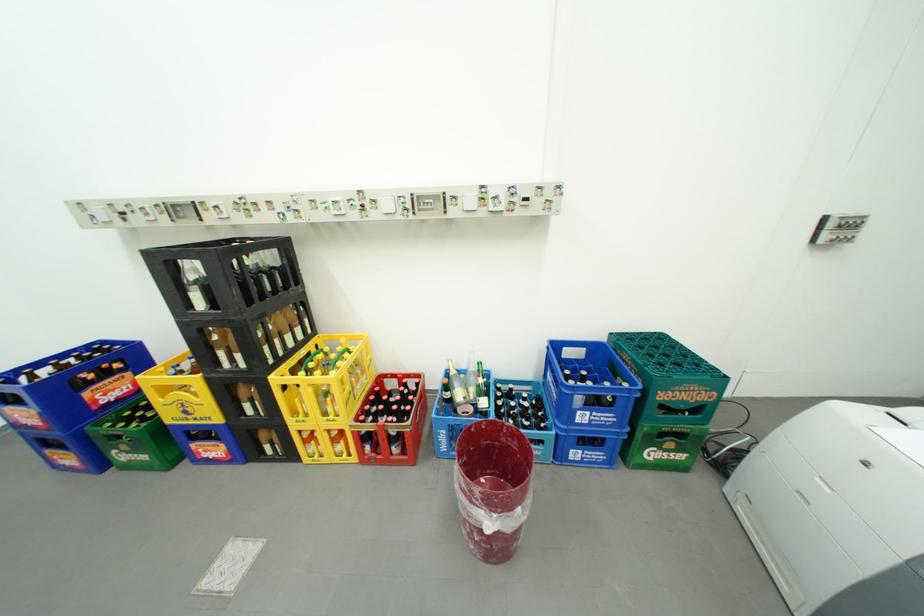
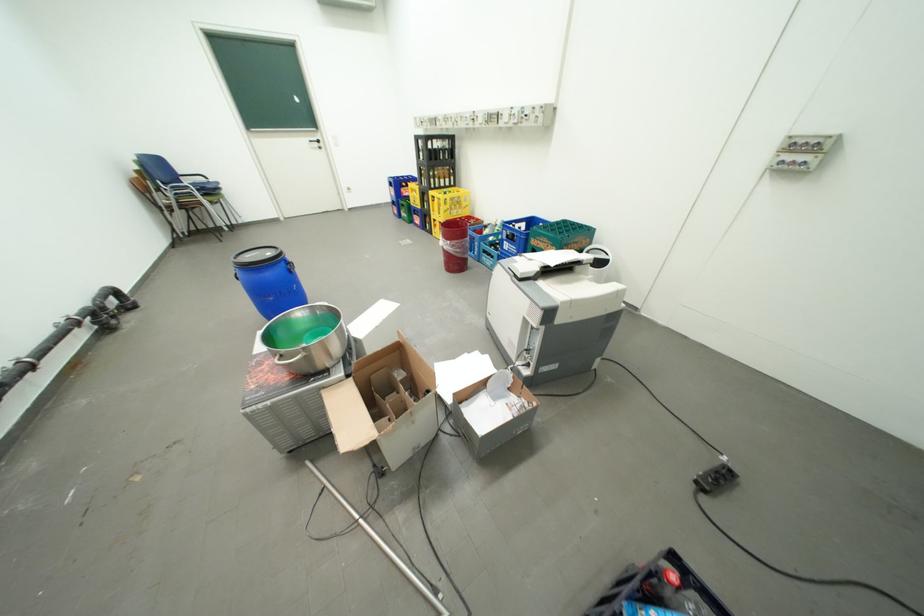
The point at (590, 414) is marked in the first image. Where is the corresponding point in the second image?

(516, 244)